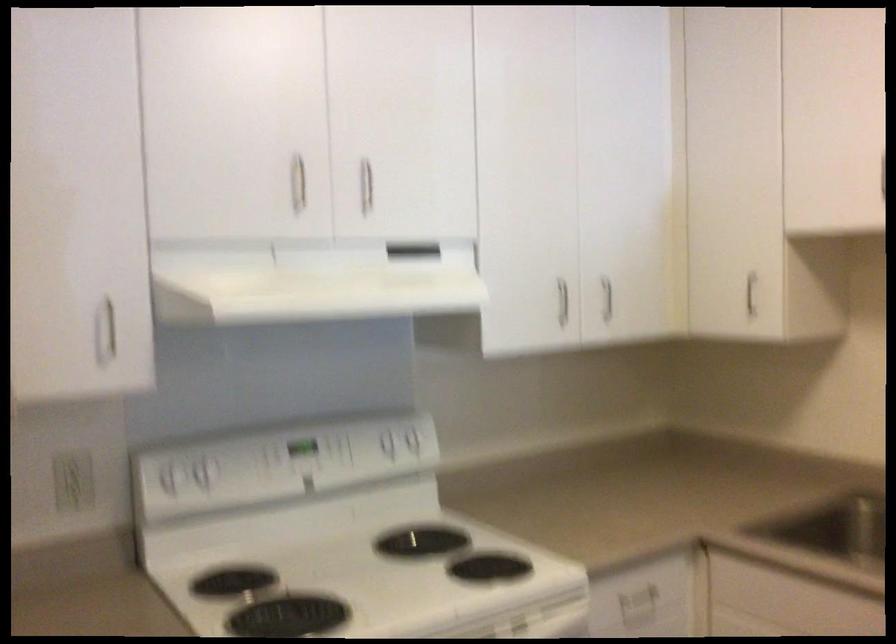
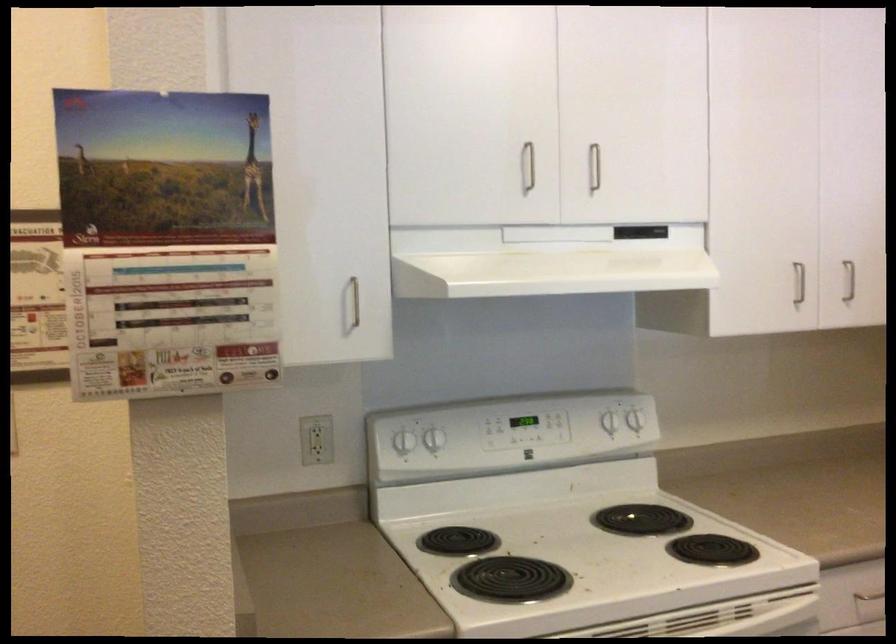
Find the pixel in the second image that matches point (606, 299) in the first image.

(849, 281)